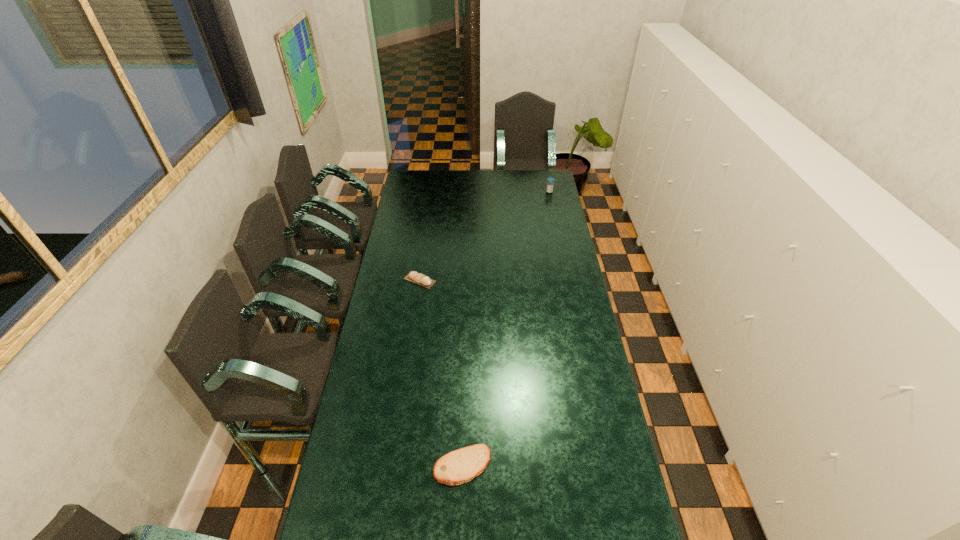
In order to click on the farthest object in this screenshot , I will do `click(549, 189)`.

At what (x,y) coordinates should I click in order to perform the action: click on medicine. Please return your answer as a coordinate pair (x, y). The width and height of the screenshot is (960, 540). Looking at the image, I should click on (549, 189).

Image resolution: width=960 pixels, height=540 pixels. Find the location of `the farther pita bread`. the farther pita bread is located at coordinates click(415, 277).

What are the coordinates of `the left pita bread` in the screenshot? It's located at (415, 277).

Find the location of a particular element. The image size is (960, 540). the nearer pita bread is located at coordinates (460, 466).

Locate an element on the screen. The width and height of the screenshot is (960, 540). the right pita bread is located at coordinates (460, 466).

Where is `free space located 0.060m on the back of the medicine`? free space located 0.060m on the back of the medicine is located at coordinates pyautogui.click(x=548, y=185).

Identify the location of vacant space located on the back of the leftmost object. (427, 227).

Identify the location of vacant space situated on the front of the second object from left to right. (461, 522).

Where is `object that is at the far edge`? Image resolution: width=960 pixels, height=540 pixels. object that is at the far edge is located at coordinates (549, 189).